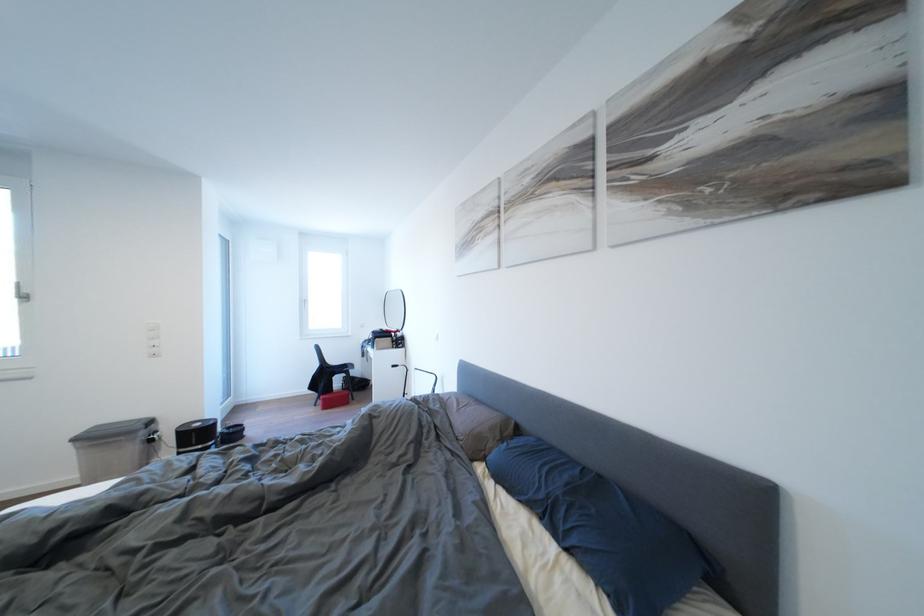
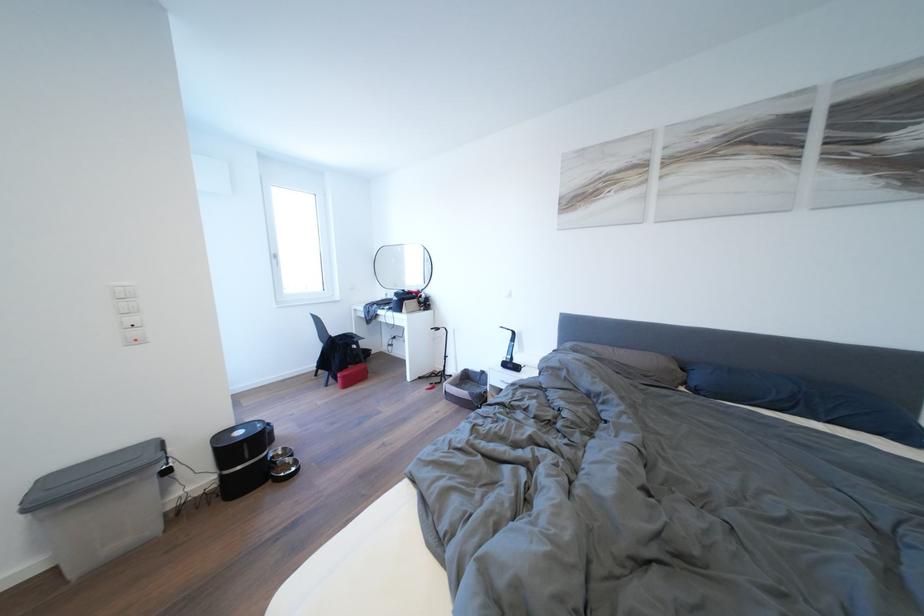
The point at [444,411] is marked in the first image. Where is the corresponding point in the second image?

(602, 360)